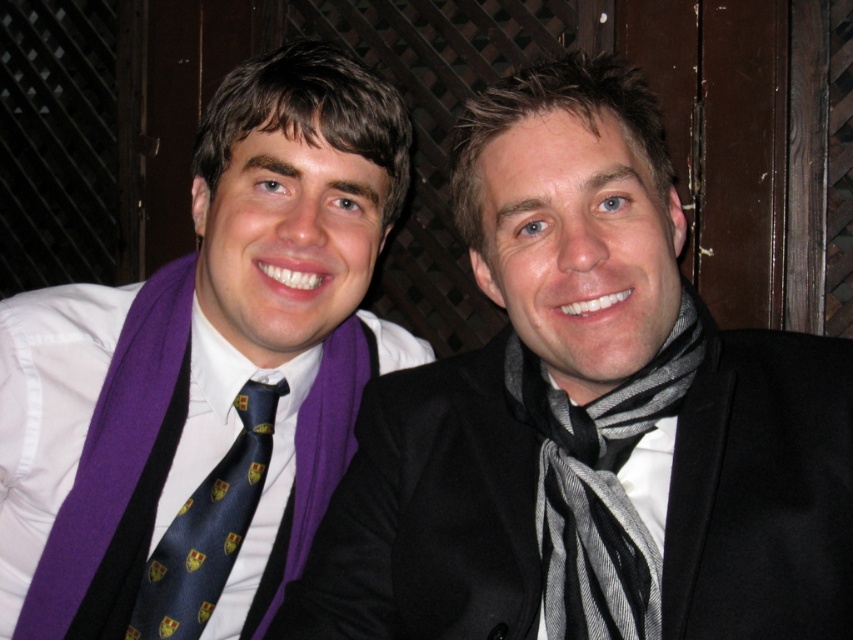
You are a photographer trying to adjust the lighting for a portrait. You notice the purple matte scarf at left and the dark blue silk tie at center. Which object is closer to the camera based on their positions?

The purple matte scarf at left is closer to the camera because it is in front of the dark blue silk tie at center.

You are a photographer trying to capture a closeup shot of both the purple fabric scarf at left and the dark blue silk tie at center. Given that your camera has a maximum focus range of 15 inches, will you be able to fit both items within the frame without moving the camera?

The purple fabric scarf at left and dark blue silk tie at center are 14.73 inches apart, which is within the camera maximum focus range of 15 inches. So yes, the photographer can capture both items in the frame without moving the camera.